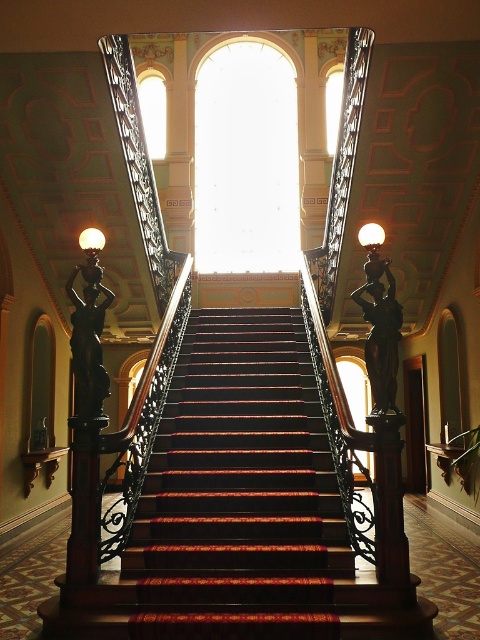
Does wooden staircase at center have a lesser height compared to black polished statue at left?

Correct, wooden staircase at center is not as tall as black polished statue at left.

Does point (196, 595) come closer to viewer compared to point (97, 268)?

Yes.

Locate an element on the screen. This screenshot has width=480, height=640. wooden staircase at center is located at coordinates (248, 509).